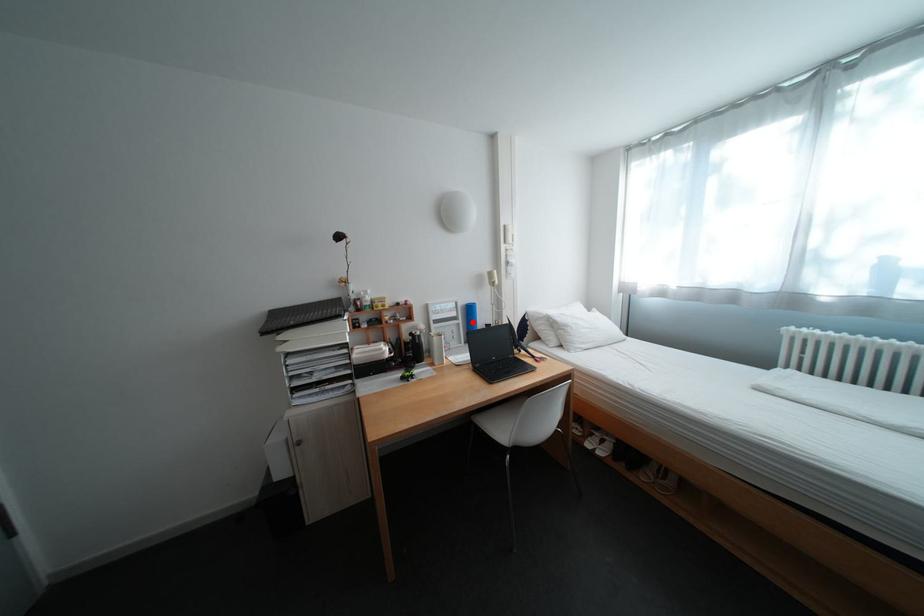
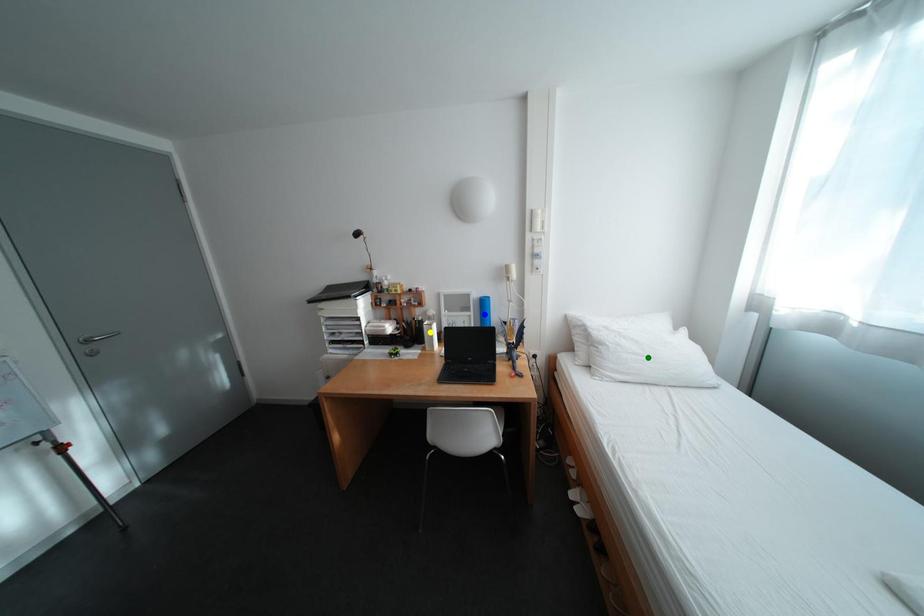
Question: I am providing you with two images of the same scene from different viewpoints. A red point is marked on the first image. You are given multiple points on the second image. Which point in image 2 represents the same 3d spot as the red point in image 1?

Choices:
 (A) blue point
 (B) green point
 (C) yellow point

Answer: (A)